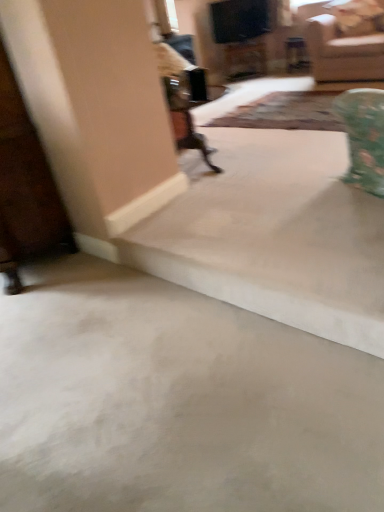
Question: Should I look upward or downward to see beige fabric couch at upper right?

Choices:
 (A) down
 (B) up

Answer: (B)

Question: Does beige fabric couch at upper right come in front of beige smooth concrete at lower center?

Choices:
 (A) no
 (B) yes

Answer: (A)

Question: Is beige fabric couch at upper right beside beige smooth concrete at lower center?

Choices:
 (A) no
 (B) yes

Answer: (A)

Question: Is beige fabric couch at upper right located outside beige smooth concrete at lower center?

Choices:
 (A) no
 (B) yes

Answer: (B)

Question: Is beige fabric couch at upper right not near beige smooth concrete at lower center?

Choices:
 (A) no
 (B) yes

Answer: (B)

Question: Is beige fabric couch at upper right oriented away from beige smooth concrete at lower center?

Choices:
 (A) yes
 (B) no

Answer: (B)

Question: From the image's perspective, is beige fabric couch at upper right below beige smooth concrete at lower center?

Choices:
 (A) yes
 (B) no

Answer: (B)

Question: Is beige fabric couch at upper right facing towards patterned fabric mat at center?

Choices:
 (A) no
 (B) yes

Answer: (B)

Question: Could patterned fabric mat at center be considered to be inside beige fabric couch at upper right?

Choices:
 (A) no
 (B) yes

Answer: (A)

Question: Is beige fabric couch at upper right oriented away from patterned fabric mat at center?

Choices:
 (A) yes
 (B) no

Answer: (B)

Question: Can you confirm if beige fabric couch at upper right is smaller than patterned fabric mat at center?

Choices:
 (A) no
 (B) yes

Answer: (A)

Question: Is beige fabric couch at upper right wider than patterned fabric mat at center?

Choices:
 (A) yes
 (B) no

Answer: (B)

Question: Can you confirm if beige fabric couch at upper right is shorter than patterned fabric mat at center?

Choices:
 (A) no
 (B) yes

Answer: (A)

Question: Can you confirm if beige smooth concrete at lower center is taller than beige fabric couch at upper right?

Choices:
 (A) no
 (B) yes

Answer: (A)